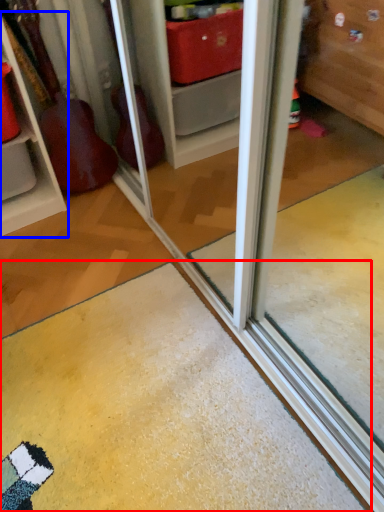
Question: Which object is closer to the camera taking this photo, doormat (highlighted by a red box) or shelf (highlighted by a blue box)?

Choices:
 (A) doormat
 (B) shelf

Answer: (A)